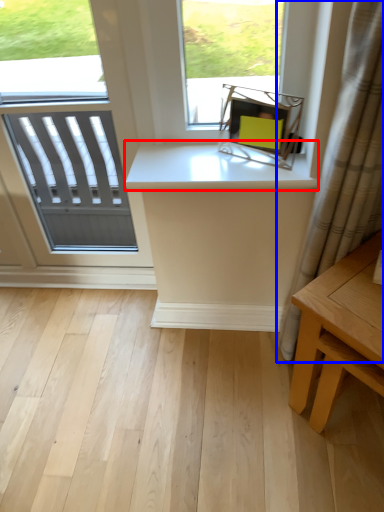
Question: Which object is further to the camera taking this photo, counter top (highlighted by a red box) or curtain (highlighted by a blue box)?

Choices:
 (A) counter top
 (B) curtain

Answer: (A)